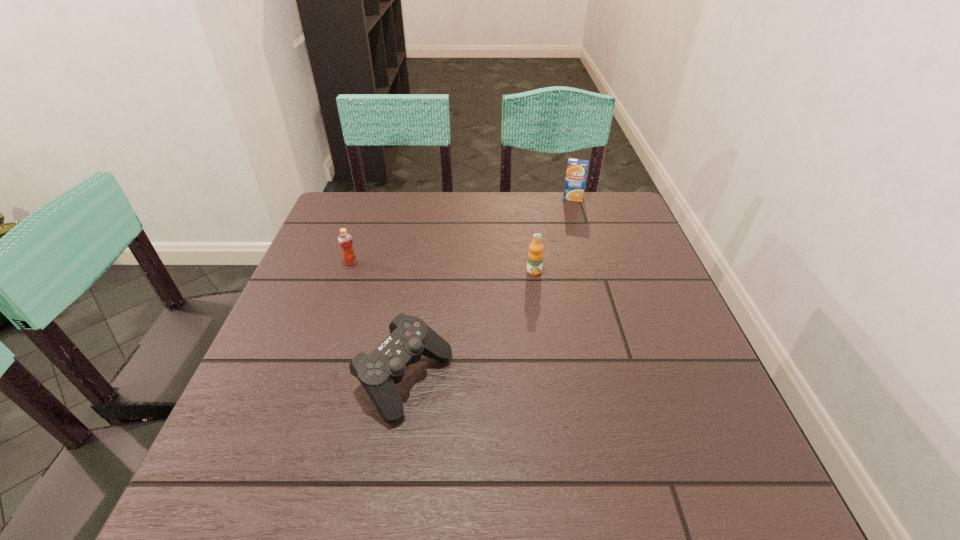
The width and height of the screenshot is (960, 540). I want to click on vacant space at the far left corner, so (379, 205).

Find the location of a particular element. The image size is (960, 540). vacant space at the far right corner of the desktop is located at coordinates click(x=630, y=211).

Where is `free location at the near right corner`? The width and height of the screenshot is (960, 540). free location at the near right corner is located at coordinates (x=708, y=470).

This screenshot has height=540, width=960. In order to click on free point between the nearest orange juice and the control in this screenshot , I will do `click(469, 326)`.

Identify the location of vacant area between the nearest orange juice and the second object from left to right. (469, 326).

Find the location of a particular element. unoccupied position between the control and the second nearest object is located at coordinates (469, 326).

At what (x,y) coordinates should I click in order to perform the action: click on free space between the nearest orange juice and the control. Please return your answer as a coordinate pair (x, y). Looking at the image, I should click on (469, 326).

At what (x,y) coordinates should I click in order to perform the action: click on vacant area that lies between the third farthest object and the rightmost object. Please return your answer as a coordinate pair (x, y). Looking at the image, I should click on pyautogui.click(x=554, y=234).

The image size is (960, 540). Find the location of `vacant area between the second nearest orange juice and the nearest orange juice`. vacant area between the second nearest orange juice and the nearest orange juice is located at coordinates (443, 267).

Where is `free point between the farthest object and the leftmost orange juice`? free point between the farthest object and the leftmost orange juice is located at coordinates tap(462, 230).